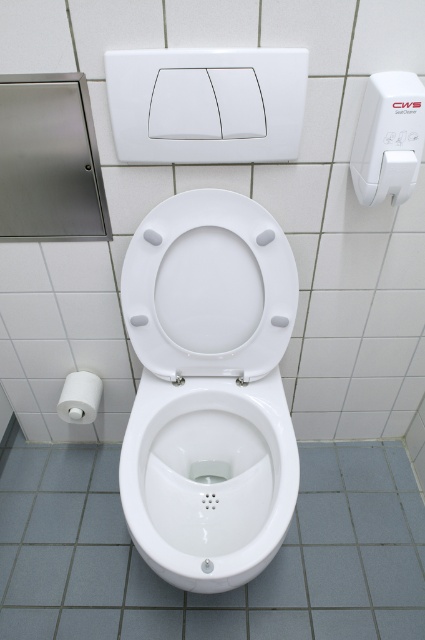
You are standing in front of the white glossy toilet bowl at center and the white glossy toilet seat at center. Which object is nearer to you?

The white glossy toilet bowl at center is closer to the viewer than the white glossy toilet seat at center.

You are standing in front of the white glossy toilet bowl at center and want to reach the white matte toilet paper at lower left. Which direction should you move to get closer to the toilet paper?

You should move to the left because the white glossy toilet bowl at center is to the right of the white matte toilet paper at lower left, meaning the toilet paper is located to your left side.